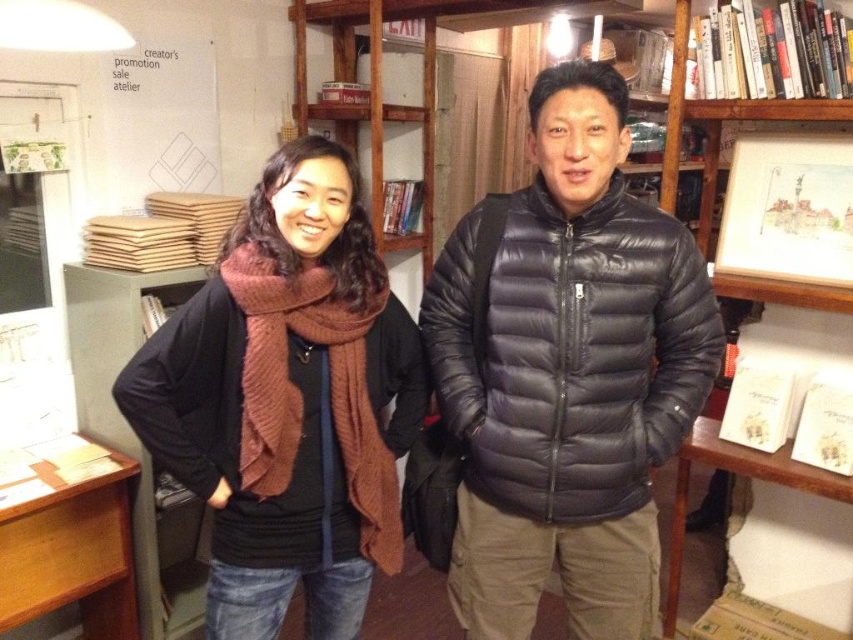
Between matte black jacket at center and wooden picture frame at upper right, which one is positioned lower?

matte black jacket at center

Who is more distant from viewer, [341,611] or [770,275]?

The point [770,275] is more distant.

The height and width of the screenshot is (640, 853). What are the coordinates of `matte black jacket at center` in the screenshot? It's located at click(x=293, y=400).

Is matte black jacket at center behind green metal cabinet at left?

No, it is not.

Does matte black jacket at center have a lesser height compared to green metal cabinet at left?

No.

Which is in front, point (467, 276) or point (175, 568)?

Point (467, 276) is more forward.

Find the location of a particular element. matte black jacket at center is located at coordinates (293, 400).

Between brown knitted scarf at center and green metal cabinet at left, which one appears on the right side from the viewer's perspective?

brown knitted scarf at center

Does brown knitted scarf at center appear over green metal cabinet at left?

Correct, brown knitted scarf at center is located above green metal cabinet at left.

The image size is (853, 640). What do you see at coordinates (287, 401) in the screenshot? I see `brown knitted scarf at center` at bounding box center [287, 401].

Where is `brown knitted scarf at center`? Image resolution: width=853 pixels, height=640 pixels. brown knitted scarf at center is located at coordinates (287, 401).